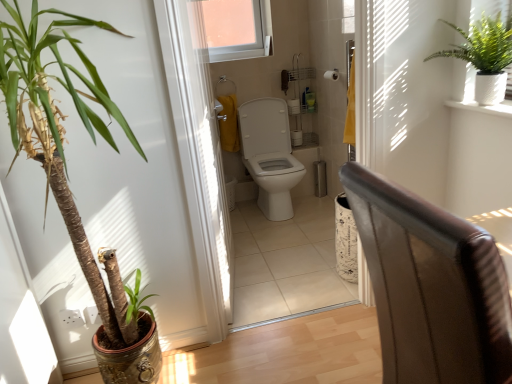
This screenshot has height=384, width=512. I want to click on free location to the right of green leafy plant at left, the first houseplant from the left, so [x=241, y=356].